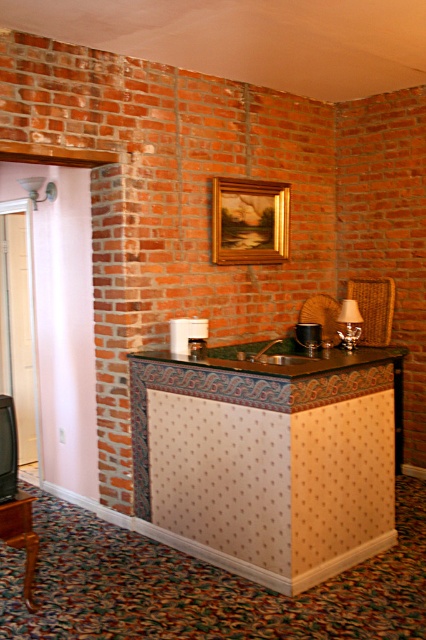
Between point (377, 285) and point (25, 564), which one is positioned in front?

Point (25, 564)

The width and height of the screenshot is (426, 640). What do you see at coordinates (374, 308) in the screenshot?
I see `woven wicker armchair at center` at bounding box center [374, 308].

What do you see at coordinates (374, 308) in the screenshot? I see `woven wicker armchair at center` at bounding box center [374, 308].

Identify the location of woven wicker armchair at center. (374, 308).

Is wicker armchair at center smaller than matte gold lampshade at upper center?

Incorrect, wicker armchair at center is not smaller in size than matte gold lampshade at upper center.

This screenshot has height=640, width=426. What do you see at coordinates (322, 316) in the screenshot?
I see `wicker armchair at center` at bounding box center [322, 316].

Is point (317, 301) positioned before point (39, 188)?

No, it is behind (39, 188).

At what (x,y) coordinates should I click in order to perform the action: click on wicker armchair at center. Please return your answer as a coordinate pair (x, y). Looking at the image, I should click on (322, 316).

Does gold wooden picture frame at upper center have a smaller size compared to matte gold lamp at center?

No.

Does gold wooden picture frame at upper center have a lesser height compared to matte gold lamp at center?

Incorrect, gold wooden picture frame at upper center's height does not fall short of matte gold lamp at center's.

Is point (230, 208) positioned after point (345, 312)?

No.

The image size is (426, 640). Identify the location of gold wooden picture frame at upper center. (250, 221).